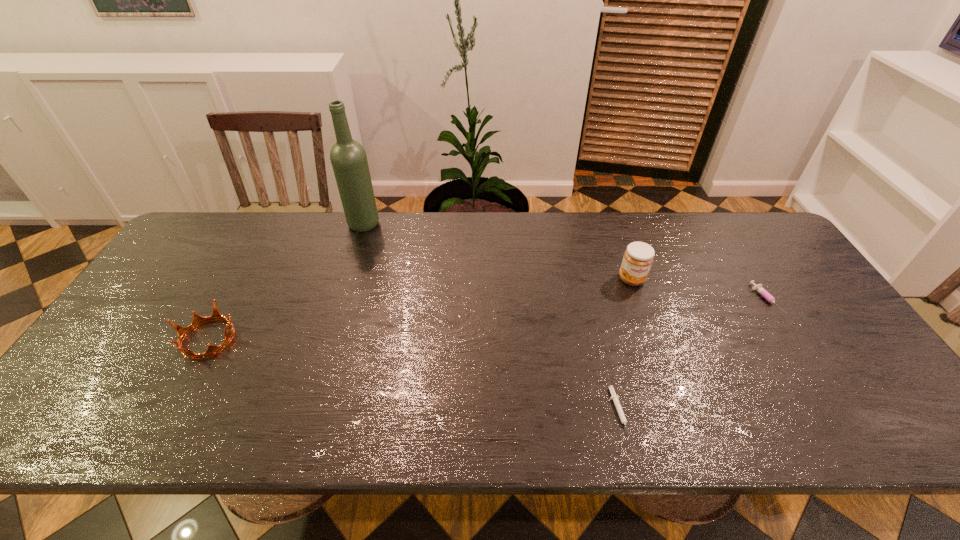
Locate an element on the screen. free space located on the left of the farthest object is located at coordinates (285, 225).

Where is `free spot located 0.190m on the front label of the fourth shortest object`? free spot located 0.190m on the front label of the fourth shortest object is located at coordinates (654, 342).

This screenshot has width=960, height=540. I want to click on vacant space located on the right of the crown, so click(328, 339).

Identify the location of free region located 0.250m on the left of the fourth tallest object. (666, 300).

Where is `vacant area situated 0.140m on the right of the third object from left to right`? The image size is (960, 540). vacant area situated 0.140m on the right of the third object from left to right is located at coordinates (686, 413).

The height and width of the screenshot is (540, 960). What are the coordinates of `object at the far edge` in the screenshot? It's located at (348, 157).

Where is `object at the near edge`? The height and width of the screenshot is (540, 960). object at the near edge is located at coordinates (615, 398).

I want to click on object present at the right edge, so click(758, 288).

At what (x,y) coordinates should I click in order to perform the action: click on blank space at the far edge of the desktop. Please return your answer as a coordinate pair (x, y). The image size is (960, 540). Looking at the image, I should click on (668, 226).

In order to click on vacant space at the near edge of the desktop in this screenshot , I will do pyautogui.click(x=428, y=434).